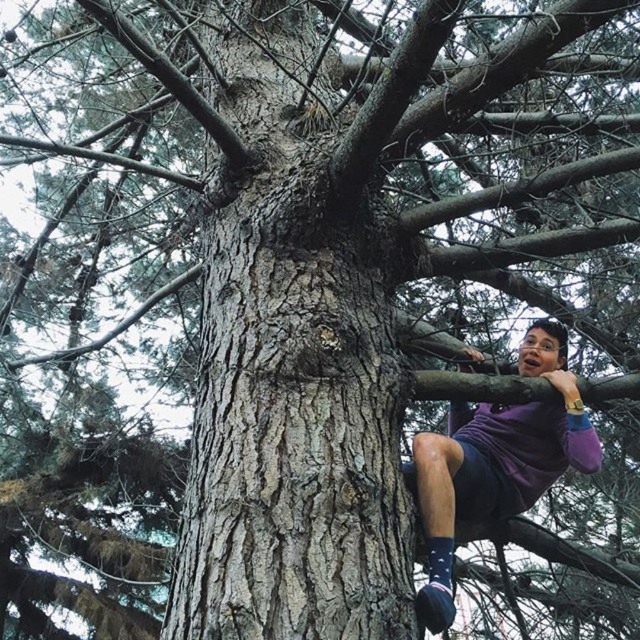
You are a photographer trying to capture the climber in the tree. You notice the smooth bark tree trunk at center and the blue textured sock at lower right. Which object should you focus on first if you want to ensure both are in sharp focus?

You should focus on the smooth bark tree trunk at center first because it is closer to you than the blue textured sock at lower right, so focusing on the closer object first increases the chance of both being in focus.

You are a hiker who wants to take a photo of the smooth bark tree trunk at center and the purple cotton shirt at right. Which object should you focus on first if you want to capture both in the frame without moving the camera?

The smooth bark tree trunk at center is much taller than the purple cotton shirt at right, so you should focus on the smooth bark tree trunk at center first to ensure it fits in the frame before adjusting for the smaller purple cotton shirt at right.